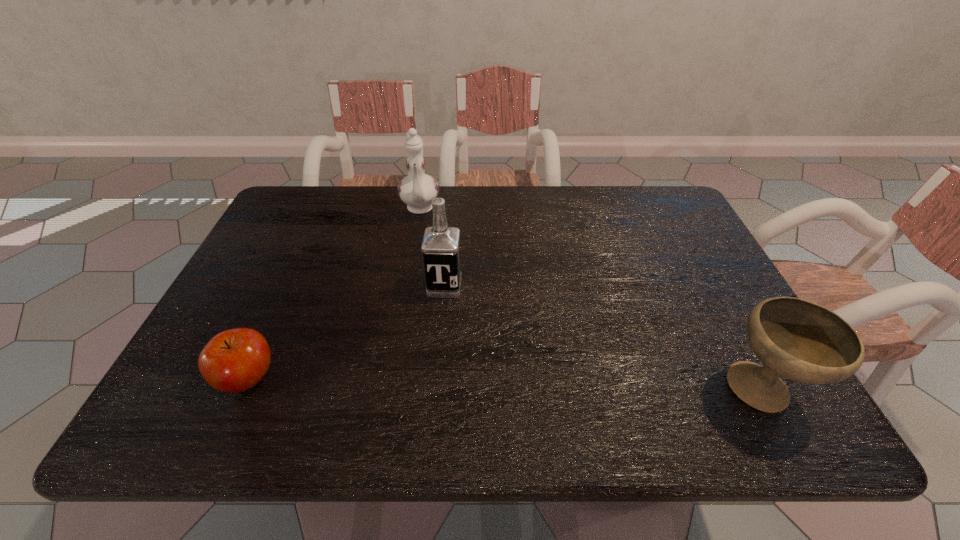
This screenshot has width=960, height=540. What are the coordinates of `object present at the near right corner` in the screenshot? It's located at (797, 339).

The image size is (960, 540). Identify the location of free space at the far edge of the desktop. (554, 205).

Image resolution: width=960 pixels, height=540 pixels. In order to click on free space at the near edge in this screenshot , I will do `click(621, 381)`.

Locate an element on the screen. Image resolution: width=960 pixels, height=540 pixels. free space at the left edge of the desktop is located at coordinates (297, 244).

Locate an element on the screen. This screenshot has width=960, height=540. free region at the right edge of the desktop is located at coordinates (679, 288).

In the image, there is a desktop. At what (x,y) coordinates should I click in order to perform the action: click on vacant space at the far left corner. Please return your answer as a coordinate pair (x, y). The height and width of the screenshot is (540, 960). Looking at the image, I should click on (299, 202).

I want to click on vacant space that's between the rightmost object and the shortest object, so click(505, 385).

I want to click on vacant point located between the apple and the vodka, so click(347, 333).

I want to click on free spot between the rightmost object and the leftmost object, so click(x=505, y=385).

Image resolution: width=960 pixels, height=540 pixels. In order to click on unoccupied area between the rightmost object and the apple in this screenshot , I will do `click(505, 385)`.